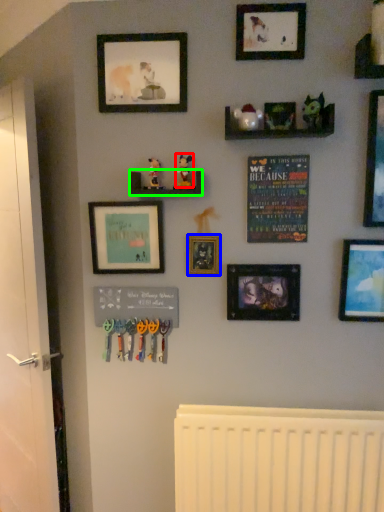
Question: Estimate the real-world distances between objects in this image. Which object is closer to toy (highlighted by a red box), picture frame (highlighted by a blue box) or shelf (highlighted by a green box)?

Choices:
 (A) picture frame
 (B) shelf

Answer: (B)